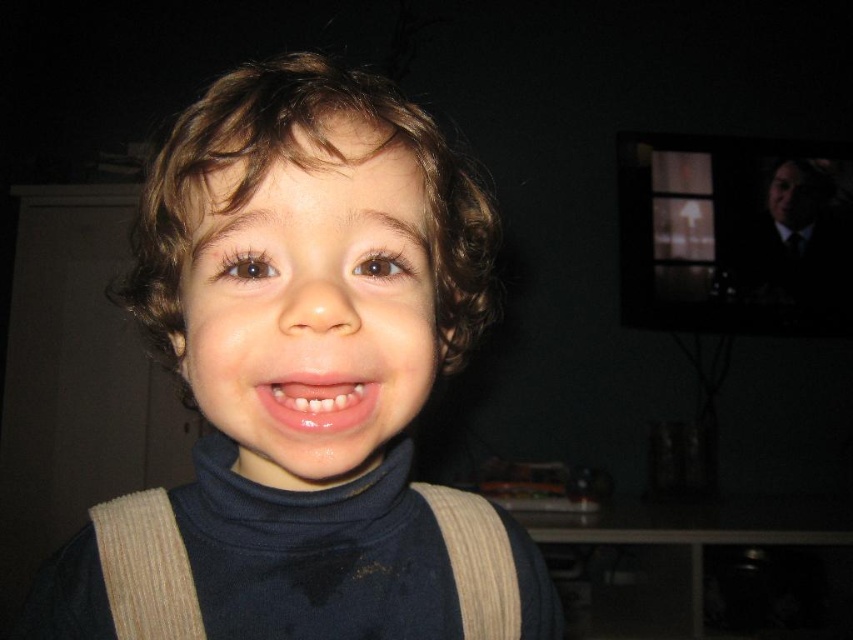
Question: Which object is farther from the camera taking this photo?

Choices:
 (A) smooth skin face at center
 (B) glossy pink lips at center
 (C) dark blue turtleneck sweater at center

Answer: (B)

Question: Is dark blue turtleneck sweater at center smaller than smooth skin face at center?

Choices:
 (A) no
 (B) yes

Answer: (A)

Question: Is dark blue turtleneck sweater at center above glossy pink lips at center?

Choices:
 (A) no
 (B) yes

Answer: (B)

Question: From the image, what is the correct spatial relationship of smooth skin face at center in relation to glossy pink lips at center?

Choices:
 (A) below
 (B) above

Answer: (B)

Question: Which object is farther from the camera taking this photo?

Choices:
 (A) dark blue turtleneck sweater at center
 (B) smooth skin face at center

Answer: (B)

Question: Among these objects, which one is nearest to the camera?

Choices:
 (A) smooth skin face at center
 (B) glossy pink lips at center
 (C) dark blue turtleneck sweater at center

Answer: (C)